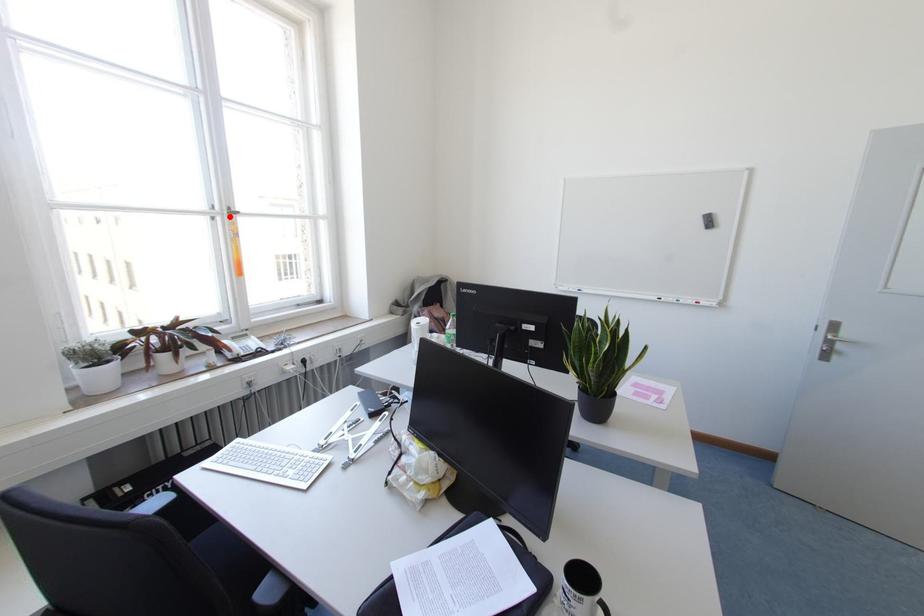
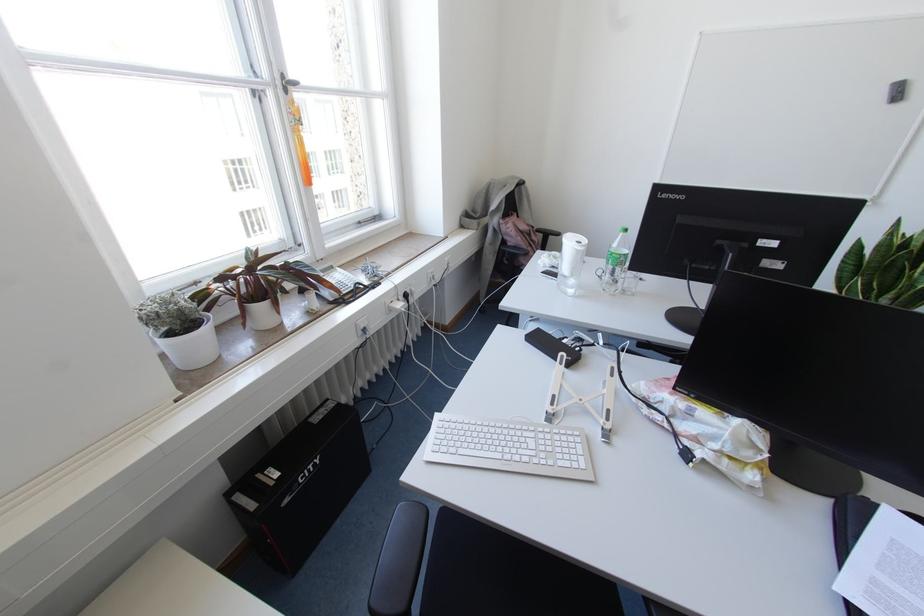
Question: I am providing you with two images of the same scene from different viewpoints. A red point is marked on the first image. Is the red point's position out of view in image 2?

Choices:
 (A) Yes
 (B) No

Answer: (B)